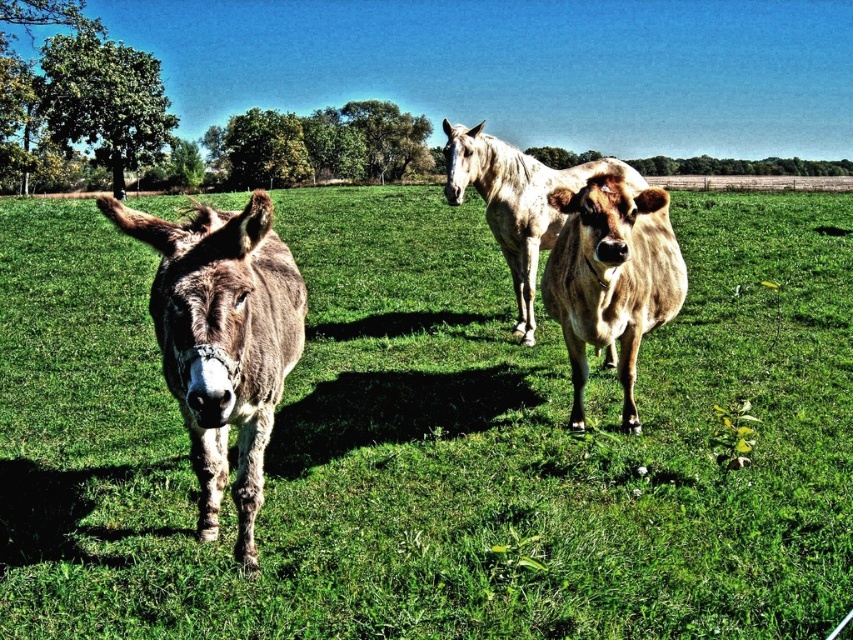
Consider the image. Between green grass at center and brown smooth cow at center, which one appears on the right side from the viewer's perspective?

green grass at center is more to the right.

Which is above, green grass at center or brown smooth cow at center?

green grass at center

The image size is (853, 640). What do you see at coordinates (434, 440) in the screenshot? I see `green grass at center` at bounding box center [434, 440].

You are a GUI agent. You are given a task and a screenshot of the screen. Output one action in this format:
    pyautogui.click(x=<x>, y=<y>)
    Task: Click on the green grass at center
    
    Given the screenshot: What is the action you would take?
    pyautogui.click(x=434, y=440)

Between brown textured mule at left and speckled white horse at center, which one appears on the right side from the viewer's perspective?

From the viewer's perspective, speckled white horse at center appears more on the right side.

Where is `brown textured mule at left`? The width and height of the screenshot is (853, 640). brown textured mule at left is located at coordinates (223, 340).

Who is shorter, green grass at center or brown textured mule at left?

brown textured mule at left is shorter.

Between point (310, 273) and point (184, 353), which one is positioned behind?

The point (310, 273) is behind.

The image size is (853, 640). I want to click on green grass at center, so click(434, 440).